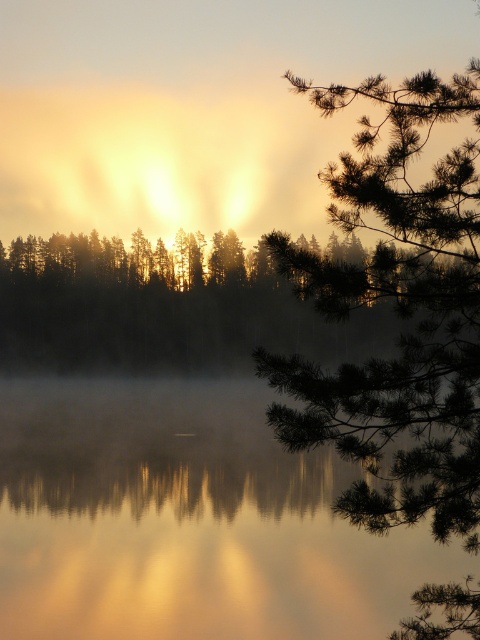
Question: Is glossy reflective water at center to the right of green needle-like branches at upper right from the viewer's perspective?

Choices:
 (A) no
 (B) yes

Answer: (A)

Question: Which object is the closest to the silvery metallic trees at center?

Choices:
 (A) glossy reflective water at center
 (B) green needle-like branches at upper right

Answer: (A)

Question: Where is glossy reflective water at center located in relation to silvery metallic trees at center in the image?

Choices:
 (A) above
 (B) below

Answer: (B)

Question: Among these points, which one is farthest from the camera?

Choices:
 (A) (72, 236)
 (B) (278, 381)
 (C) (33, 488)

Answer: (A)

Question: Which point is closer to the camera taking this photo?

Choices:
 (A) (213, 257)
 (B) (197, 458)
 (C) (470, 307)

Answer: (C)

Question: Does glossy reflective water at center come behind silvery metallic trees at center?

Choices:
 (A) yes
 (B) no

Answer: (B)